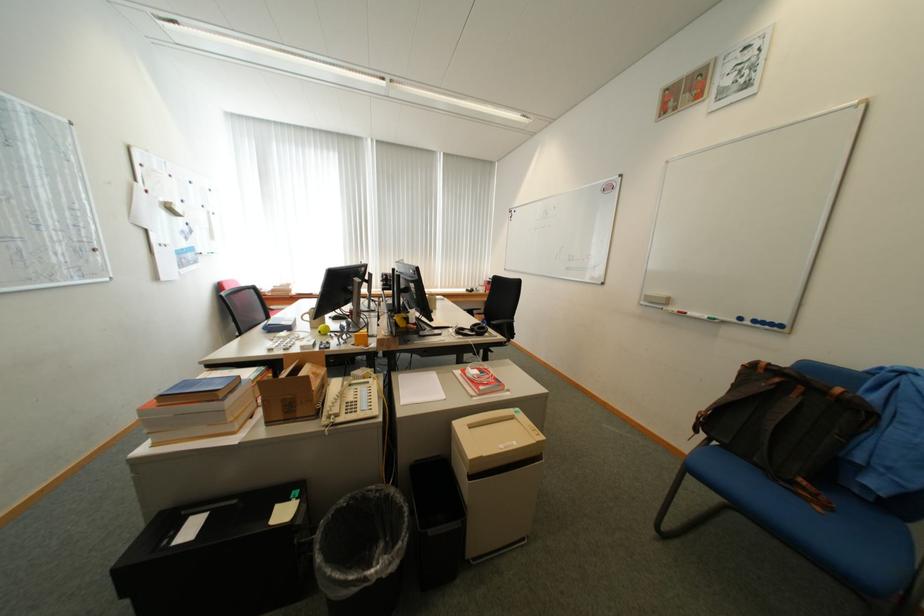
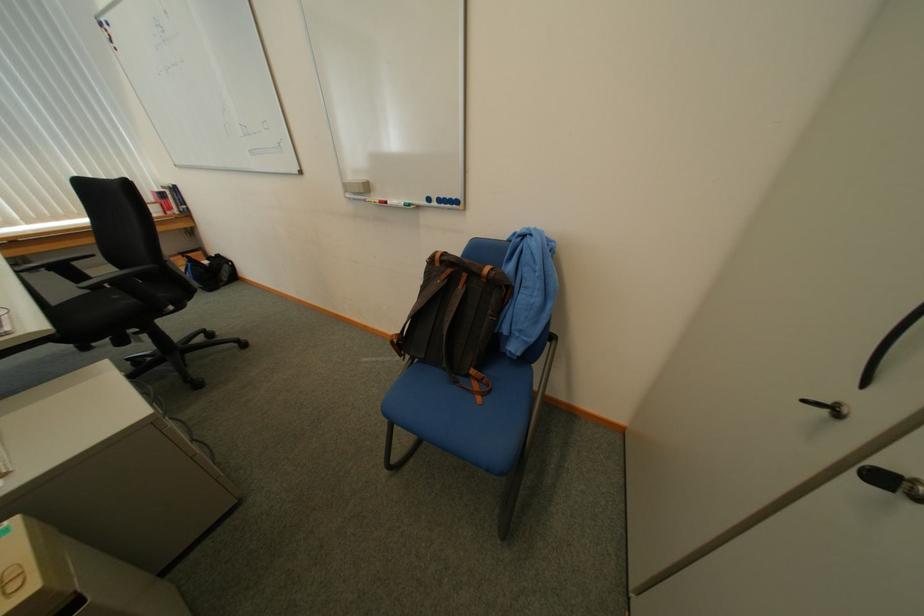
How did the camera likely rotate?

The rotation direction of the camera is right-down.